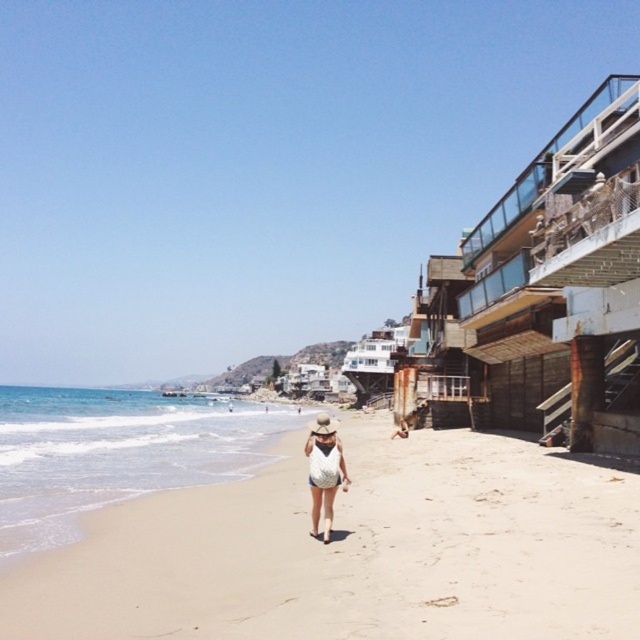
Question: Is beige sandy beach at center below white textured dress at center?

Choices:
 (A) yes
 (B) no

Answer: (A)

Question: Which of the following is the farthest from the observer?

Choices:
 (A) beige sandy beach at center
 (B) white textured dress at center

Answer: (B)

Question: Does beige sandy beach at center have a lesser width compared to white textured dress at center?

Choices:
 (A) yes
 (B) no

Answer: (B)

Question: Which of the following is the closest to the observer?

Choices:
 (A) beige sandy beach at center
 (B) white textured dress at center

Answer: (A)

Question: Is beige sandy beach at center thinner than white textured dress at center?

Choices:
 (A) no
 (B) yes

Answer: (A)